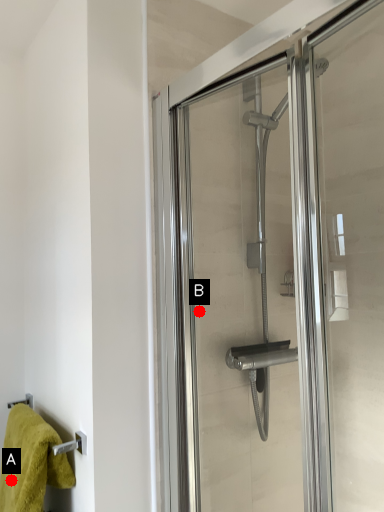
Question: Two points are circled on the image, labeled by A and B beside each circle. Which of the following is the closest to the observer?

Choices:
 (A) A is closer
 (B) B is closer

Answer: (A)